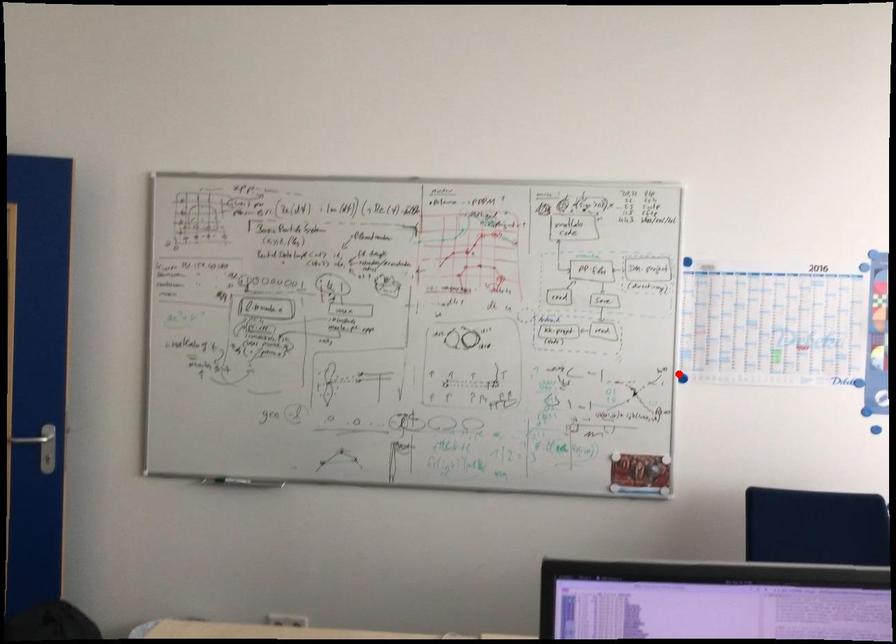
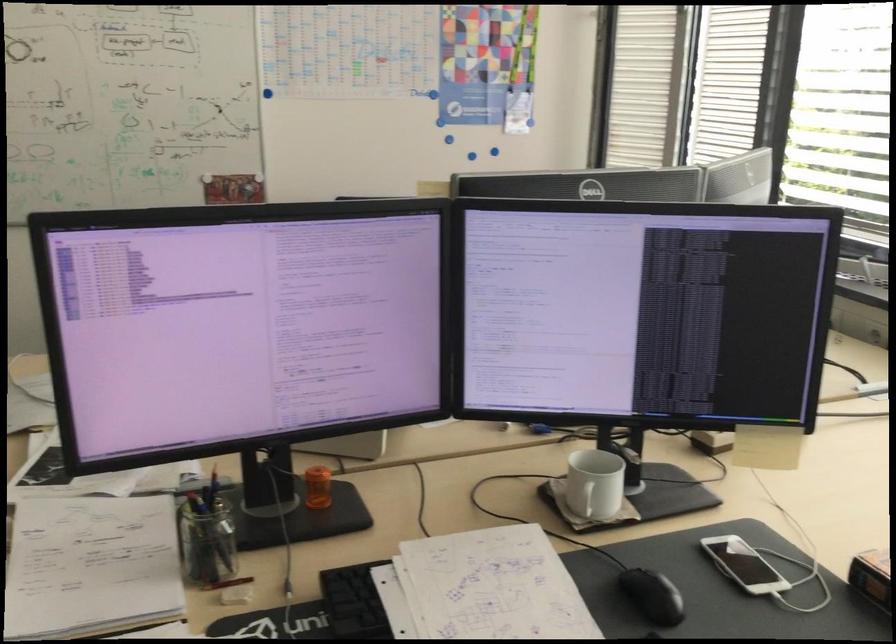
Find the pixel in the second image that matches the highlighted location in the first image.

(266, 93)